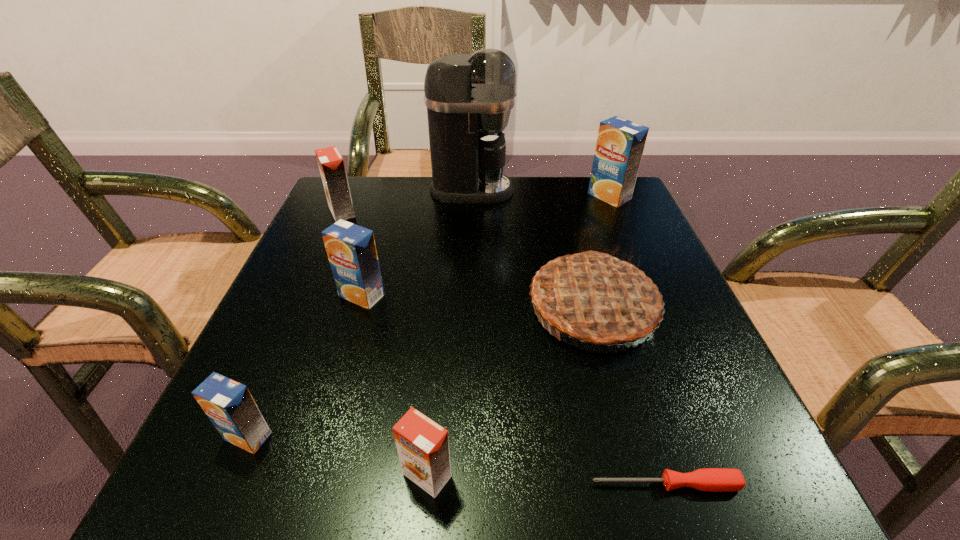
At what (x,y) coordinates should I click in order to perform the action: click on free space located 0.340m at the tip of the shortest object. Please return your answer as a coordinate pair (x, y). The width and height of the screenshot is (960, 540). Looking at the image, I should click on (321, 484).

In order to click on blank space located 0.390m at the tip of the shortest object in this screenshot , I will do `click(281, 484)`.

Identify the location of vacant space located at the tip of the shortest object. This screenshot has height=540, width=960. (369, 484).

You are a GUI agent. You are given a task and a screenshot of the screen. Output one action in this format:
    pyautogui.click(x=<x>, y=<y>)
    Task: Click on the coffee maker positioned at the far edge
    This screenshot has height=540, width=960.
    Given the screenshot: What is the action you would take?
    pyautogui.click(x=463, y=93)

The width and height of the screenshot is (960, 540). Find the location of `screwdriver at the near edge`. screwdriver at the near edge is located at coordinates (708, 479).

Identify the location of orange_juice that is positioned at the right edge. This screenshot has width=960, height=540. (620, 144).

This screenshot has width=960, height=540. I want to click on pie that is at the right edge, so click(594, 297).

I want to click on screwdriver situated at the right edge, so click(708, 479).

Identify the location of object that is at the far left corner. The width and height of the screenshot is (960, 540). (331, 164).

Locate an element on the screen. Image resolution: width=960 pixels, height=540 pixels. object positioned at the near left corner is located at coordinates click(x=229, y=405).